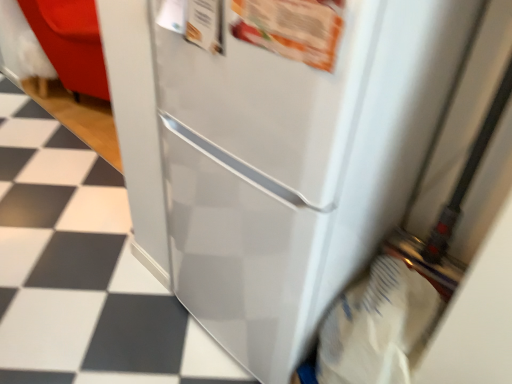
Question: In terms of height, does white glossy tile at lower left, which ranks as the first tile in front-to-back order, look taller or shorter compared to white glossy tile at lower left, acting as the first tile starting from the top?

Choices:
 (A) tall
 (B) short

Answer: (B)

Question: Considering their positions, is white glossy tile at lower left, which ranks as the first tile in front-to-back order, located in front of or behind white glossy tile at lower left, placed as the second tile when sorted from bottom to top?

Choices:
 (A) front
 (B) behind

Answer: (A)

Question: Considering the real-world distances, which object is farthest from the white glossy tile at lower left, arranged as the 2th tile when viewed from the left?

Choices:
 (A) white glossy tile at lower left, arranged as the 1th tile when viewed from the back
 (B) white paper grocery bag at lower right

Answer: (A)

Question: Considering the real-world distances, which object is farthest from the white glossy tile at lower left, positioned as the 2th tile in right-to-left order?

Choices:
 (A) white glossy tile at lower left, arranged as the 2th tile when viewed from the left
 (B) white paper grocery bag at lower right

Answer: (B)